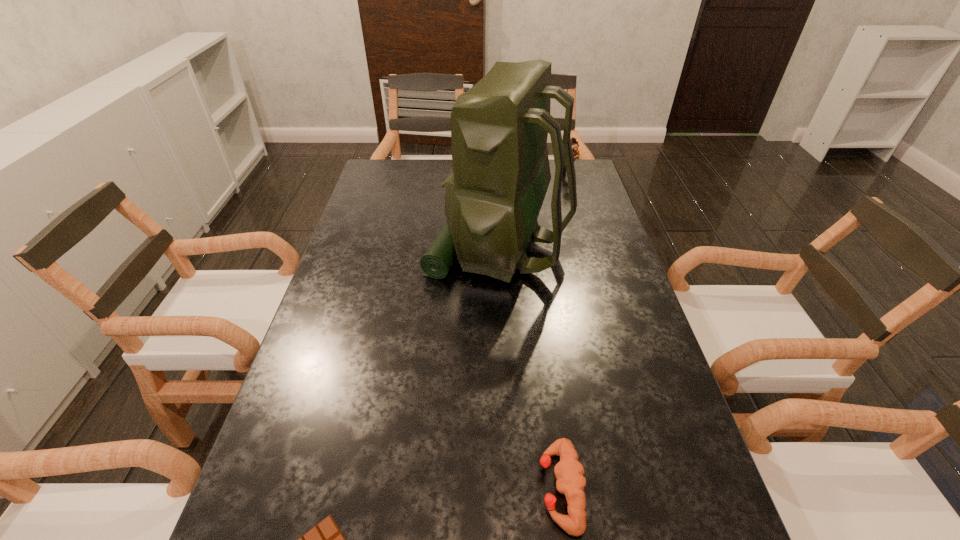
At what (x,y) coordinates should I click in order to perform the action: click on vacant position at the far left corner of the desktop. Please return your answer as a coordinate pair (x, y). The width and height of the screenshot is (960, 540). Looking at the image, I should click on (384, 168).

Identify the location of unoccupied area between the left puncher and the tallest object. Image resolution: width=960 pixels, height=540 pixels. (529, 368).

Find the location of a particular element. The image size is (960, 540). free point between the shorter puncher and the right puncher is located at coordinates (564, 330).

Choose which object is the second nearest neighbor to the shortest object. Please provide its 2D coordinates. Your answer should be formatted as a tuple, i.e. [(x, y)], where the tuple contains the x and y coordinates of a point satisfying the conditions above.

[(499, 128)]

Locate an element on the screen. The height and width of the screenshot is (540, 960). object that is the closest one to the shorter puncher is located at coordinates 325,539.